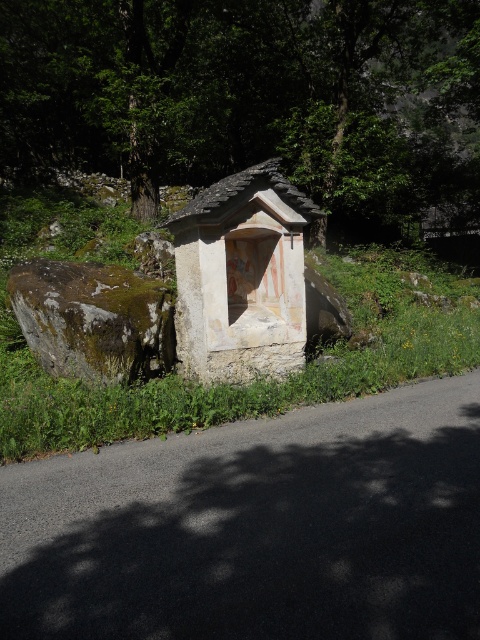
Looking at this image, you are an architect designing a new garden path that needs to pass between the stone wall at center and the white stone shrine at center. The path must be at least 1 meter wide to accommodate visitors. Given the spatial relationship between these two structures, can the path be constructed as planned?

The stone wall at center is wider than the white stone shrine at center, but the description does not provide specific measurements of their widths. Without knowing the exact dimensions, it is impossible to determine if the path can be 1 meter wide. Additional measurements are needed to confirm feasibility.

You are a hiker who wants to place a small statue exactly halfway between the stone wall at center and the green mossy rock at left. Can you determine which object you are closer to while placing the statue?

The stone wall at center is taller than the green mossy rock at left, but since you are placing the statue halfway between them, you will be equidistant from both objects.

You are a tourist visiting this serene roadside scene. You see the stone wall at center and the white stone shrine at center. Which one do you think is bigger in size?

The stone wall at center is larger in size than the white stone shrine at center, so the stone wall at center is bigger.